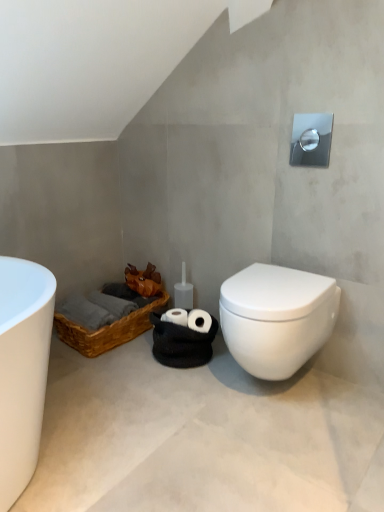
Where is `free space above white matte concrete at lower center (from a real-world perspective)`? Image resolution: width=384 pixels, height=512 pixels. free space above white matte concrete at lower center (from a real-world perspective) is located at coordinates (195, 411).